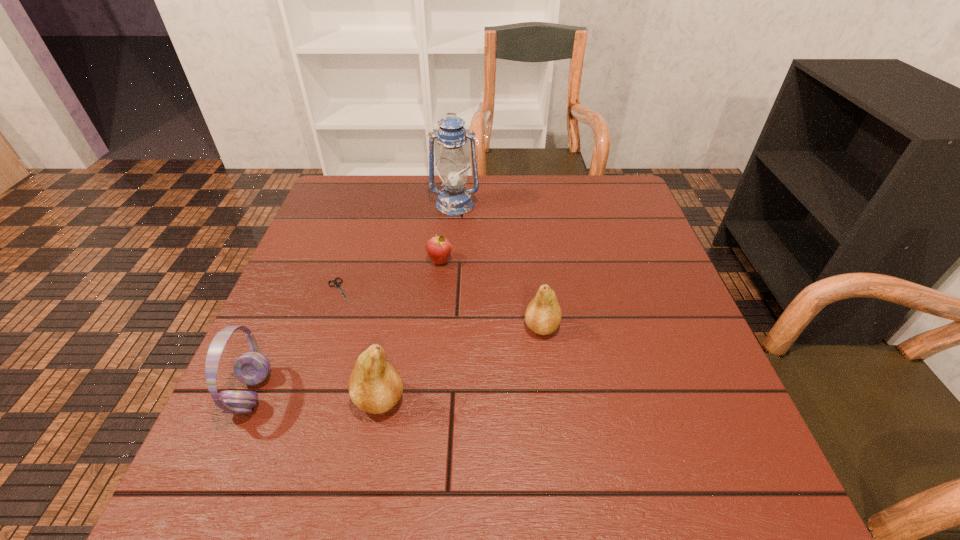
Locate an element on the screen. Image resolution: width=960 pixels, height=540 pixels. the leftmost object is located at coordinates (251, 368).

The height and width of the screenshot is (540, 960). Identify the location of vacant space located on the right of the left pear. (502, 400).

The width and height of the screenshot is (960, 540). Find the location of `free space located 0.060m on the back of the rightmost object`. free space located 0.060m on the back of the rightmost object is located at coordinates (538, 294).

Image resolution: width=960 pixels, height=540 pixels. Find the location of `vacant space located 0.220m on the front-facing side of the farthest object`. vacant space located 0.220m on the front-facing side of the farthest object is located at coordinates (450, 267).

Identify the location of vacant space located on the right of the fifth nearest object. (537, 261).

This screenshot has width=960, height=540. Identify the location of free spot located on the front of the fifth object from right to left. (307, 387).

Locate an element on the screen. The width and height of the screenshot is (960, 540). vacant space located on the headband and ear cups of the headset is located at coordinates (418, 393).

Where is `object that is at the far edge`? This screenshot has width=960, height=540. object that is at the far edge is located at coordinates (454, 200).

At what (x,y) coordinates should I click in order to perform the action: click on pear that is at the near edge. Please return your answer as a coordinate pair (x, y). Looking at the image, I should click on (375, 386).

The image size is (960, 540). Find the location of `headset at the near edge`. headset at the near edge is located at coordinates (251, 368).